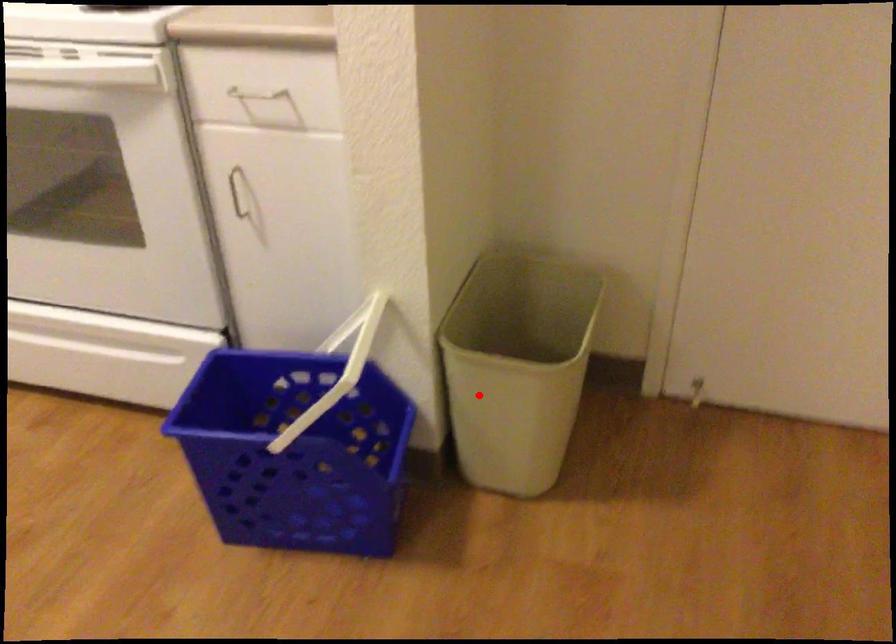
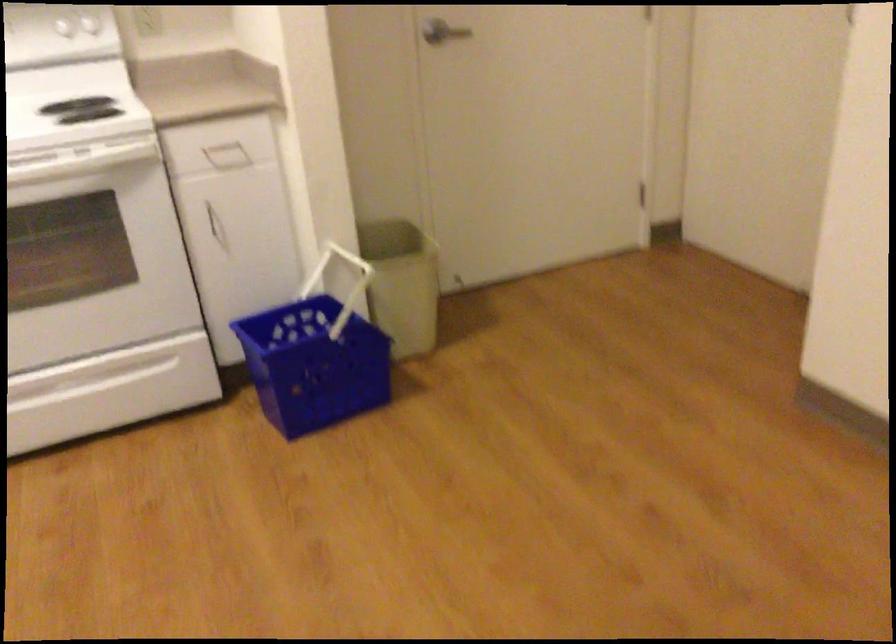
Locate, in the second image, the point that corresponds to the highlighted location in the first image.

(401, 283)